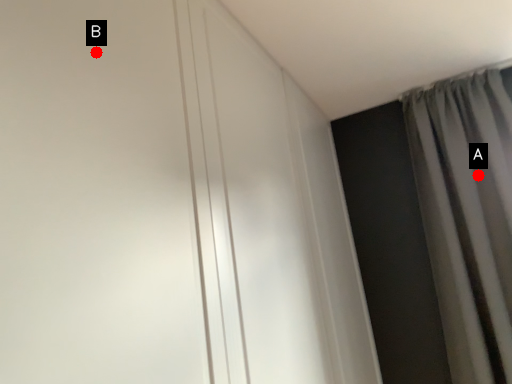
Question: Two points are circled on the image, labeled by A and B beside each circle. Which point is closer to the camera taking this photo?

Choices:
 (A) A is closer
 (B) B is closer

Answer: (B)